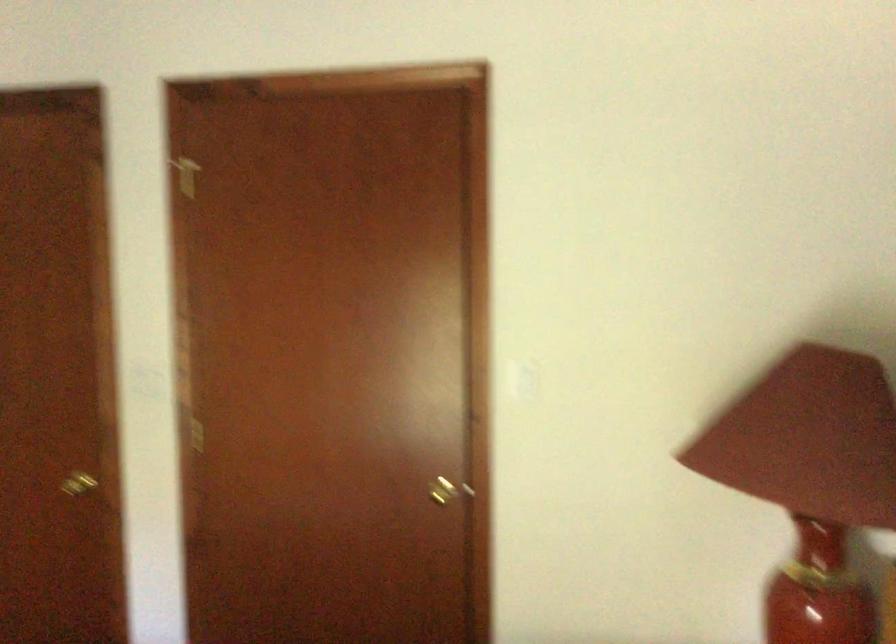
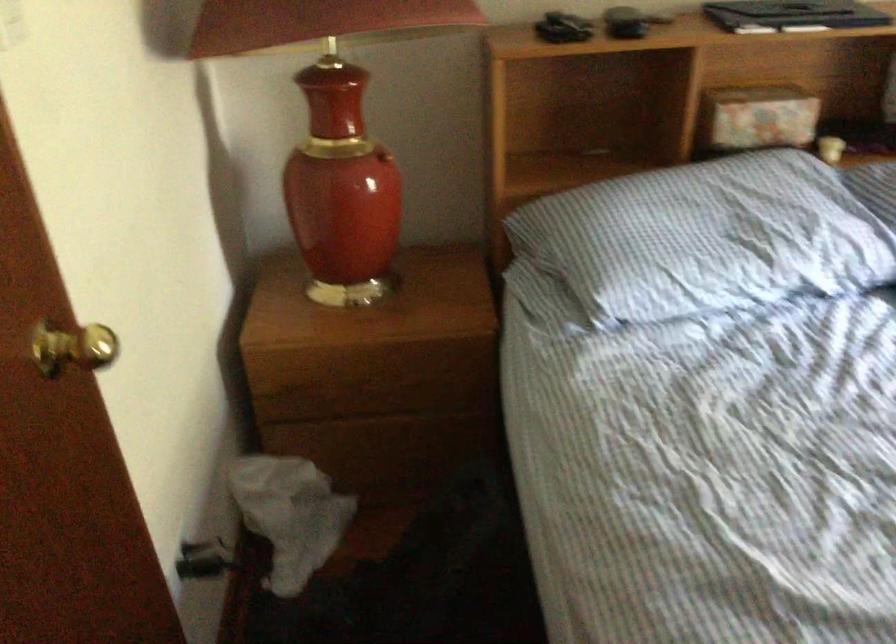
Find the pixel in the second image that matches point 433,482 in the first image.

(73, 348)